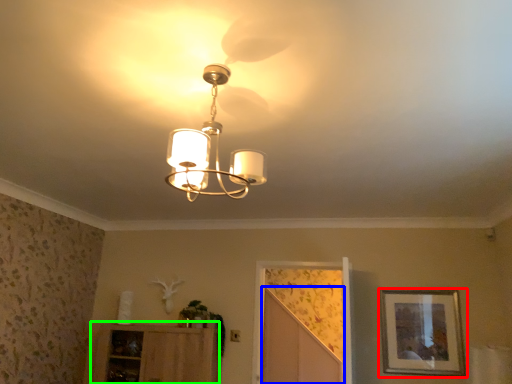
Question: Estimate the real-world distances between objects in this image. Which object is closer to picture frame (highlighted by a red box), screen door (highlighted by a blue box) or cabinetry (highlighted by a green box)?

Choices:
 (A) screen door
 (B) cabinetry

Answer: (A)